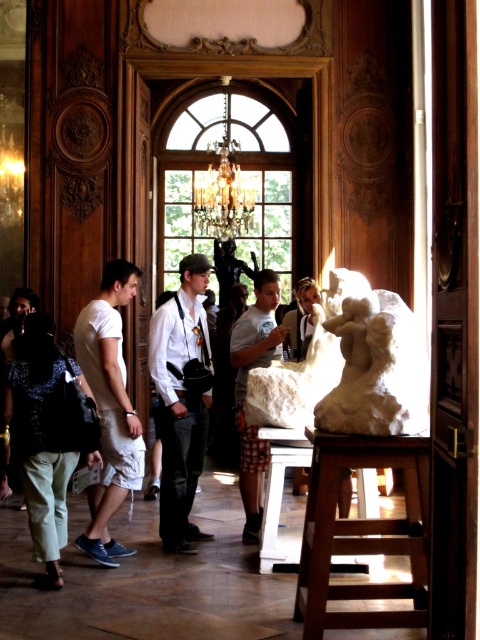
You are standing in the grand room and want to move from the entrance to the large white marble sculpture in the foreground. There are denim pants at lower left and white cotton shorts at left in your path. Which object should you avoid stepping on to reach the sculpture safely?

You should avoid stepping on the denim pants at lower left because it is in front of the white cotton shorts at left, meaning it is closer to your path towards the sculpture.

You are standing in the grand room and want to know how far the point at coordinates (336, 285) is from you. Can you determine the distance?

The point at coordinates (336, 285) is 23.33 meters away from the viewer.